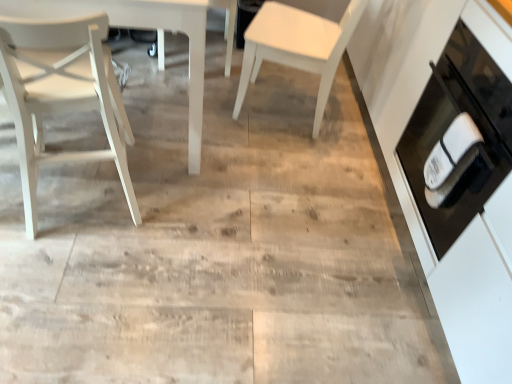
Question: Is there a large distance between white matte chair at center, the 1th chair in the right-to-left sequence, and white matte chair at center, arranged as the second chair when viewed from the right?

Choices:
 (A) no
 (B) yes

Answer: (A)

Question: From a real-world perspective, is white matte chair at center, the third chair when ordered from left to right, located beneath white matte chair at center, arranged as the second chair when viewed from the right?

Choices:
 (A) no
 (B) yes

Answer: (A)

Question: Considering the relative positions of white matte chair at center, the 1th chair in the right-to-left sequence, and white matte chair at center, the second chair in the left-to-right sequence, in the image provided, is white matte chair at center, the 1th chair in the right-to-left sequence, to the right of white matte chair at center, the second chair in the left-to-right sequence, from the viewer's perspective?

Choices:
 (A) no
 (B) yes

Answer: (B)

Question: Can you confirm if white matte chair at center, the third chair when ordered from left to right, is positioned to the left of white matte chair at center, the second chair in the left-to-right sequence?

Choices:
 (A) yes
 (B) no

Answer: (B)

Question: From the image's perspective, is white matte chair at center, the 1th chair in the right-to-left sequence, below white matte chair at center, arranged as the second chair when viewed from the right?

Choices:
 (A) yes
 (B) no

Answer: (A)

Question: Is white matte chair at center, the third chair when ordered from left to right, shorter than white matte chair at center, the second chair in the left-to-right sequence?

Choices:
 (A) yes
 (B) no

Answer: (B)

Question: Considering the relative sizes of black glass oven at right and white matte chair at center, arranged as the second chair when viewed from the right, in the image provided, is black glass oven at right bigger than white matte chair at center, arranged as the second chair when viewed from the right,?

Choices:
 (A) no
 (B) yes

Answer: (B)

Question: Is black glass oven at right thinner than white matte chair at center, arranged as the second chair when viewed from the right?

Choices:
 (A) yes
 (B) no

Answer: (B)

Question: From the image's perspective, is black glass oven at right above white matte chair at center, arranged as the second chair when viewed from the right?

Choices:
 (A) no
 (B) yes

Answer: (A)

Question: Does black glass oven at right come behind white matte chair at center, arranged as the second chair when viewed from the right?

Choices:
 (A) no
 (B) yes

Answer: (A)

Question: Does black glass oven at right have a smaller size compared to white matte chair at center, arranged as the second chair when viewed from the right?

Choices:
 (A) yes
 (B) no

Answer: (B)

Question: From a real-world perspective, is black glass oven at right physically below white matte chair at center, the second chair in the left-to-right sequence?

Choices:
 (A) yes
 (B) no

Answer: (B)

Question: From a real-world perspective, is black glass oven at right located beneath white matte chair at left, which ranks as the 3th chair in right-to-left order?

Choices:
 (A) yes
 (B) no

Answer: (B)